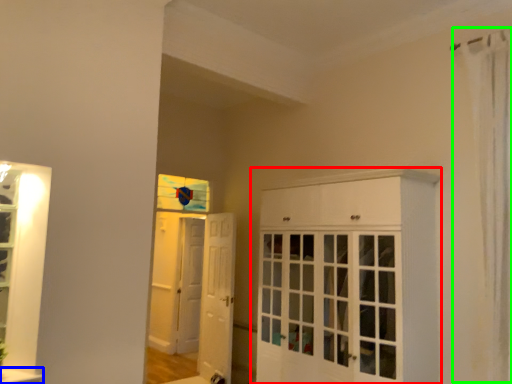
Question: Estimate the real-world distances between objects in this image. Which object is closer to cabinetry (highlighted by a red box), window sill (highlighted by a blue box) or shower curtain (highlighted by a green box)?

Choices:
 (A) window sill
 (B) shower curtain

Answer: (B)